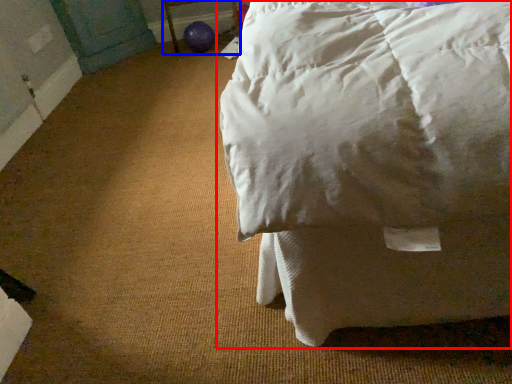
Question: Which point is further to the camera, bed (highlighted by a red box) or furniture (highlighted by a blue box)?

Choices:
 (A) bed
 (B) furniture

Answer: (B)